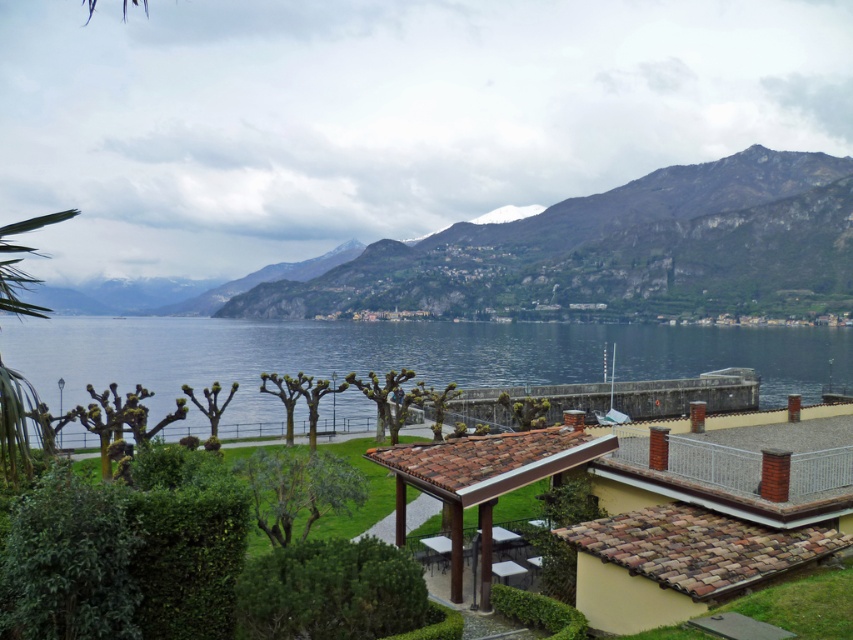
Question: Among these objects, which one is nearest to the camera?

Choices:
 (A) blue water at center
 (B) green rocky mountain at upper center

Answer: (A)

Question: Is green rocky mountain at upper center thinner than blue water at center?

Choices:
 (A) yes
 (B) no

Answer: (B)

Question: Is green rocky mountain at upper center thinner than blue water at center?

Choices:
 (A) no
 (B) yes

Answer: (A)

Question: Does green rocky mountain at upper center appear over blue water at center?

Choices:
 (A) yes
 (B) no

Answer: (A)

Question: Among these objects, which one is farthest from the camera?

Choices:
 (A) blue water at center
 (B) green rocky mountain at upper center

Answer: (B)

Question: Which object appears farthest from the camera in this image?

Choices:
 (A) blue water at center
 (B) green rocky mountain at upper center

Answer: (B)